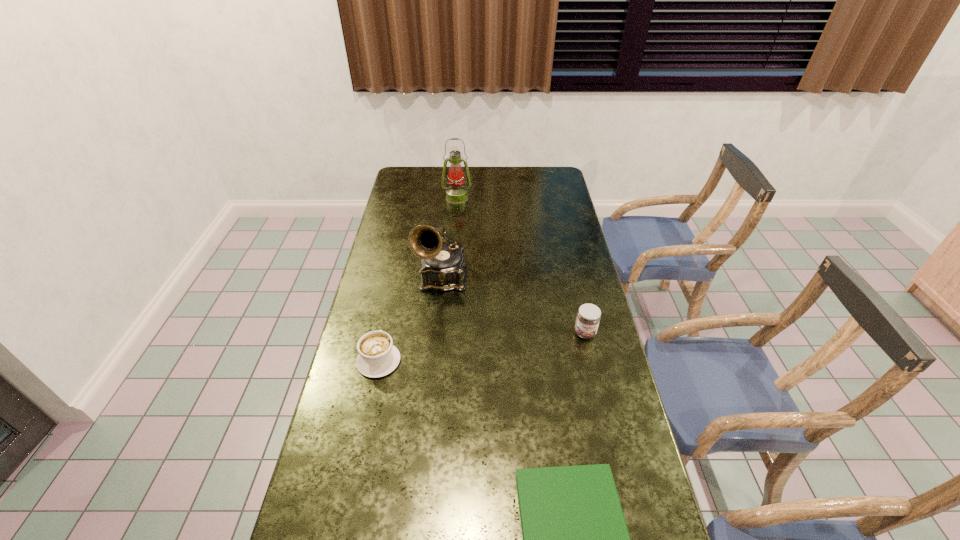
The width and height of the screenshot is (960, 540). Identify the location of vacant space located 0.120m to the right of the second nearest object's handle. (389, 314).

The width and height of the screenshot is (960, 540). Find the location of `blank space located to the right of the second nearest object's handle`. blank space located to the right of the second nearest object's handle is located at coordinates (395, 284).

This screenshot has width=960, height=540. Find the location of `object that is at the left edge`. object that is at the left edge is located at coordinates (377, 357).

The image size is (960, 540). Find the location of `object situated at the right edge`. object situated at the right edge is located at coordinates (588, 318).

Locate an element on the screen. free space at the far edge is located at coordinates (431, 188).

Image resolution: width=960 pixels, height=540 pixels. In order to click on vacant space at the left edge of the desktop in this screenshot , I will do `click(342, 410)`.

In the image, there is a desktop. Identify the location of vacant space at the right edge. This screenshot has width=960, height=540. (544, 221).

Identify the location of vacant space at the far right corner. The height and width of the screenshot is (540, 960). (x=564, y=176).

Find the location of a particular element. Image resolution: width=960 pixels, height=540 pixels. vacant point located between the farthest object and the second nearest object is located at coordinates (418, 279).

Where is `free space that is in between the leftmost object and the jam`? The width and height of the screenshot is (960, 540). free space that is in between the leftmost object and the jam is located at coordinates (482, 347).